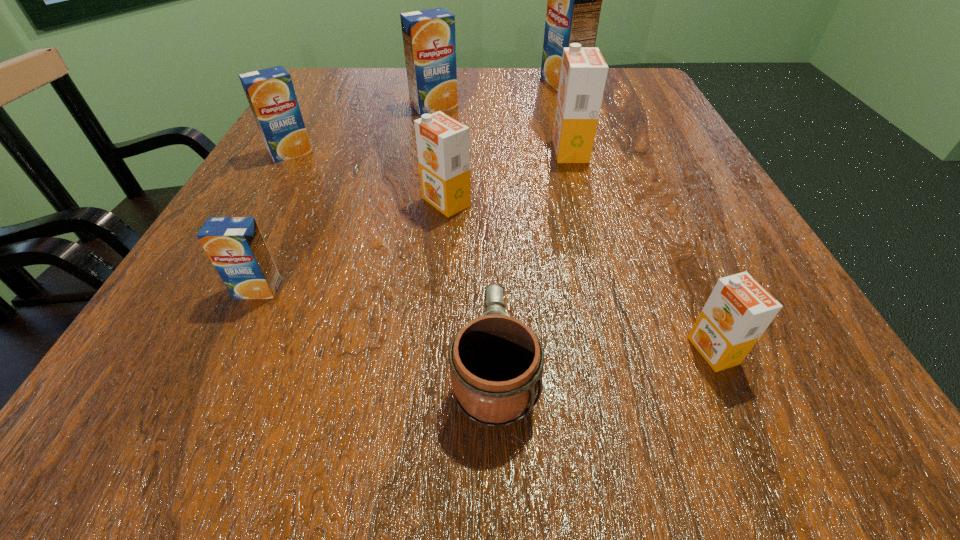
In order to click on vacant space located on the back of the rightmost orange juice in this screenshot , I will do `click(679, 272)`.

Locate an element on the screen. Image resolution: width=960 pixels, height=540 pixels. vacant space located on the side of the shortest object with the handle is located at coordinates (490, 201).

I want to click on vacant space located 0.140m on the side of the shortest object with the handle, so click(491, 246).

Identify the location of vacant region located on the side of the shortest object with the handle. (490, 180).

Image resolution: width=960 pixels, height=540 pixels. I want to click on object that is at the near edge, so click(x=496, y=362).

Image resolution: width=960 pixels, height=540 pixels. I want to click on object that is at the far right corner, so click(574, 0).

Locate an element on the screen. The height and width of the screenshot is (540, 960). free space at the far edge of the desktop is located at coordinates (544, 108).

In the image, there is a desktop. What are the coordinates of `vacant space at the left edge` in the screenshot? It's located at (298, 247).

Find the location of a particular element. The image size is (960, 540). free space at the right edge of the desktop is located at coordinates (646, 146).

In the image, there is a desktop. Where is `vacant space at the far left corner`? The image size is (960, 540). vacant space at the far left corner is located at coordinates (324, 72).